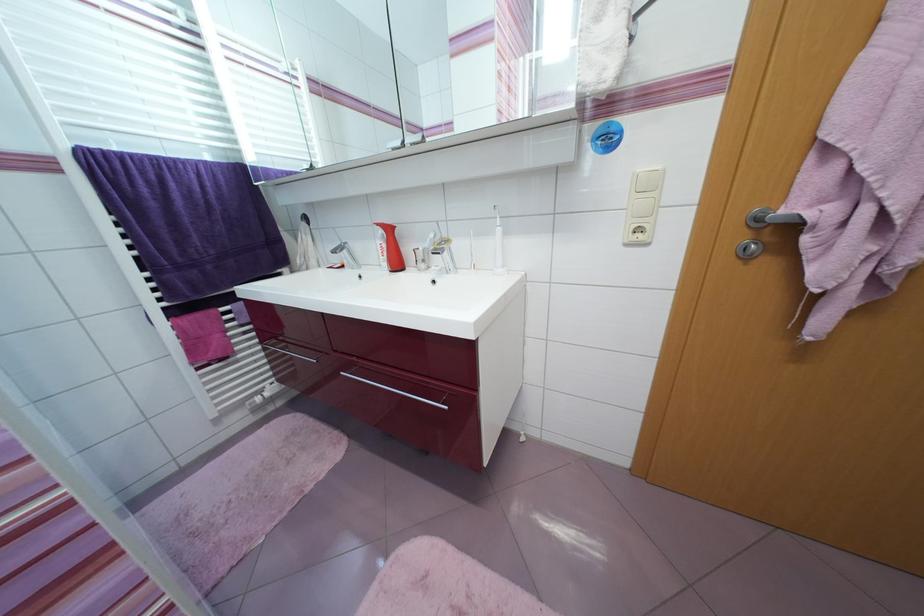
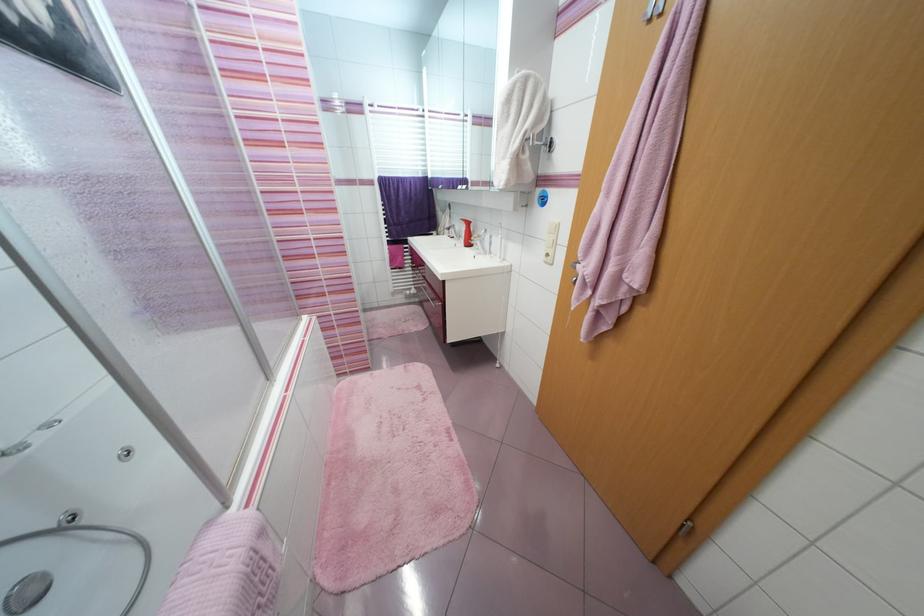
Where in the second image is the point corresponding to point 479,339 from the first image?

(445, 281)